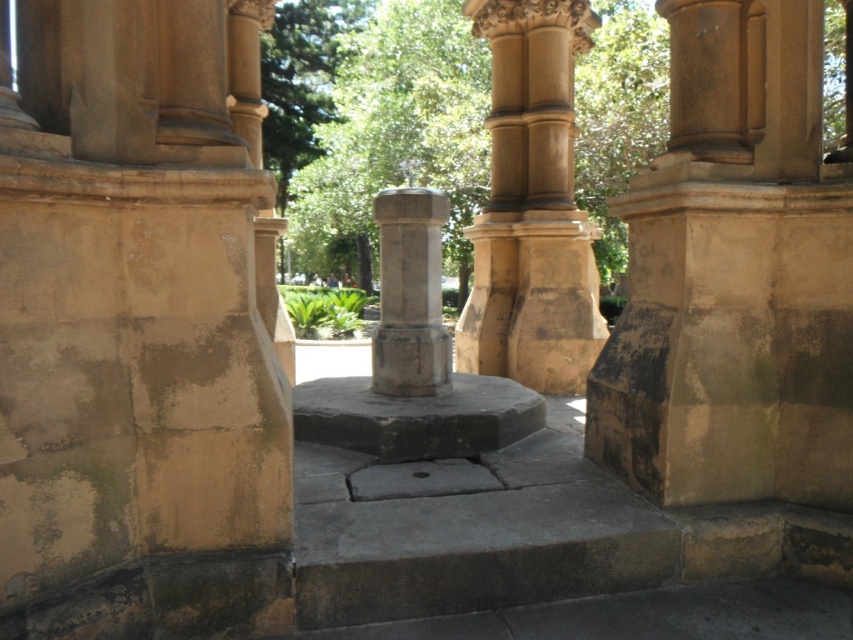
What do you see at coordinates (531, 205) in the screenshot? This screenshot has height=640, width=853. I see `matte stone column at center` at bounding box center [531, 205].

Which is behind, point (549, 26) or point (498, 392)?

Point (549, 26)

Find the location of a particular element. matte stone column at center is located at coordinates (531, 205).

Who is higher up, dark gray stone pedestal at center or stone column at center?

Positioned higher is stone column at center.

Does dark gray stone pedestal at center have a lesser width compared to stone column at center?

No, dark gray stone pedestal at center is not thinner than stone column at center.

Which is behind, point (396, 396) or point (425, 348)?

Point (396, 396)

Where is `dark gray stone pedestal at center`? dark gray stone pedestal at center is located at coordinates (416, 417).

Between matte stone column at center and stone column at center, which one appears on the right side from the viewer's perspective?

matte stone column at center is more to the right.

This screenshot has height=640, width=853. Describe the element at coordinates (531, 205) in the screenshot. I see `matte stone column at center` at that location.

Which is in front, point (521, 186) or point (393, 349)?

Point (393, 349)

The image size is (853, 640). Identify the location of matte stone column at center. (531, 205).